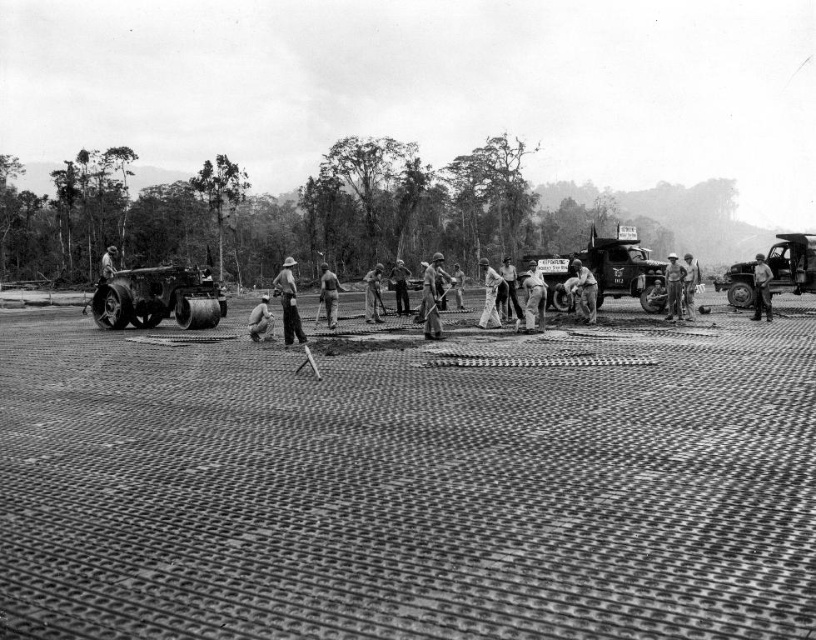
Question: Observing the image, what is the correct spatial positioning of matte black roller at left in reference to light brown uniform at center?

Choices:
 (A) below
 (B) above

Answer: (A)

Question: Is matte black roller at left thinner than light brown uniform at center?

Choices:
 (A) yes
 (B) no

Answer: (B)

Question: Is the position of matte black roller at left more distant than that of light brown wooden shovel at center?

Choices:
 (A) no
 (B) yes

Answer: (A)

Question: Among these points, which one is nearest to the camera?

Choices:
 (A) (366, 276)
 (B) (149, 316)
 (C) (761, 260)

Answer: (C)

Question: Estimate the real-world distances between objects in this image. Which object is closer to the light brown wooden shovel at center?

Choices:
 (A) light brown uniform at center
 (B) matte black roller at left

Answer: (B)

Question: Among these points, which one is nearest to the camera?

Choices:
 (A) (380, 269)
 (B) (766, 310)

Answer: (B)